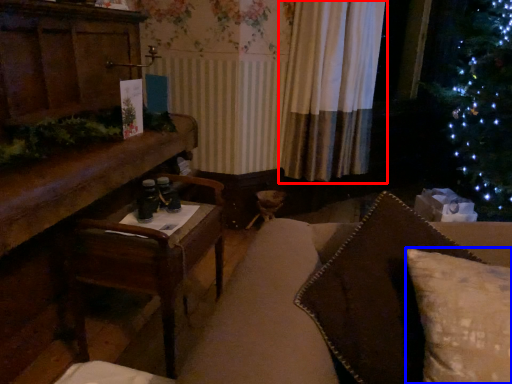
Question: Which point is closer to the camera, curtain (highlighted by a red box) or pillow (highlighted by a blue box)?

Choices:
 (A) curtain
 (B) pillow

Answer: (B)